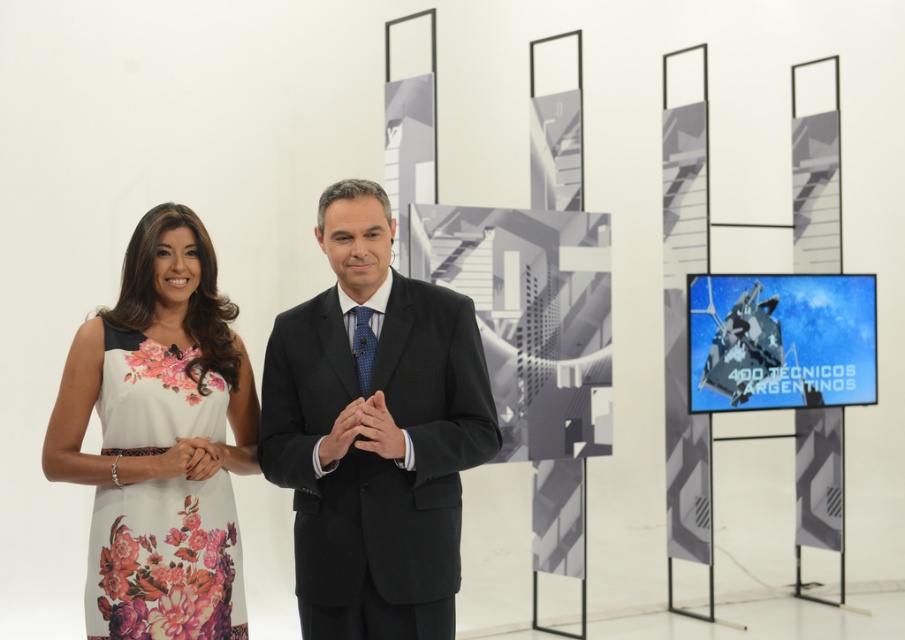
You are a photographer setting up for a photoshoot. You need to ensure that the black suit at center and the floral printed fabric dress at left are both visible in the frame. Based on their positions, which object is covering part of the other?

The black suit at center is positioned over the floral printed fabric dress at left, meaning it partially covers the dress in the image.

What are the coordinates of the black suit at center?

The coordinates of the black suit at center are point (374, 432).